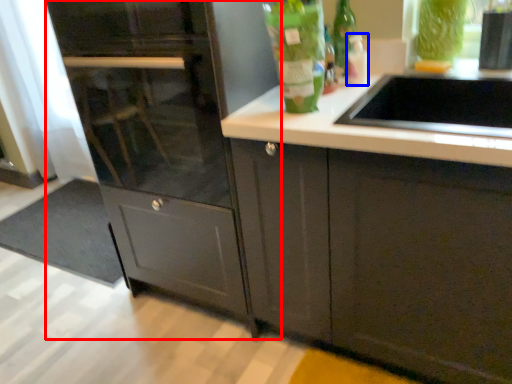
Question: Which of the following is the closest to the observer, cabinetry (highlighted by a red box) or bottle (highlighted by a blue box)?

Choices:
 (A) cabinetry
 (B) bottle

Answer: (A)